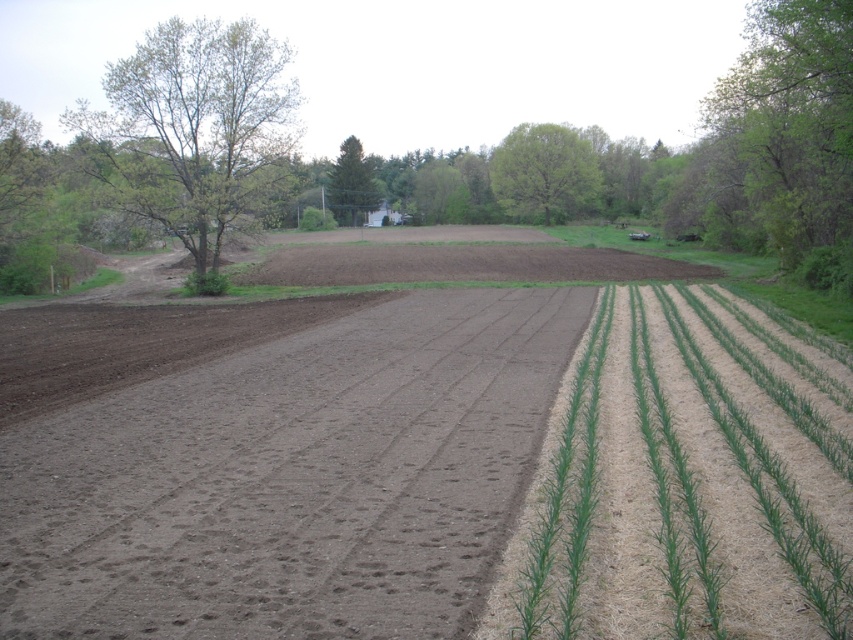
You are a farmer planning to install a fence between the two green leafy trees. Given that the distance between them is exactly 73.85 meters, what is the minimum length of fencing material you need to span the gap between the green leafy tree at upper left and the green leafy tree at upper right?

The minimum length of fencing material needed is 73.85 meters, as this is the exact distance between the green leafy tree at upper left and the green leafy tree at upper right.

You are a farmer planning to plant new crops between the green leafy tree at upper right and the green textured tree at center. Based on their positions, which tree should you avoid planting too close to in order to ensure proper growth?

You should avoid planting too close to the green leafy tree at upper right because it is in front of the green textured tree at center, meaning it is closer to you. Planting near the closer tree may lead to competition for resources and hinder the growth of your new crops.

Consider the image. You are a farmer planning to plant crops in the brown soil at center and green leafy tree at center. Based on their sizes, which area would allow for more rows of crops?

The green leafy tree at center has a larger area than the brown soil at center, so it can accommodate more rows of crops.